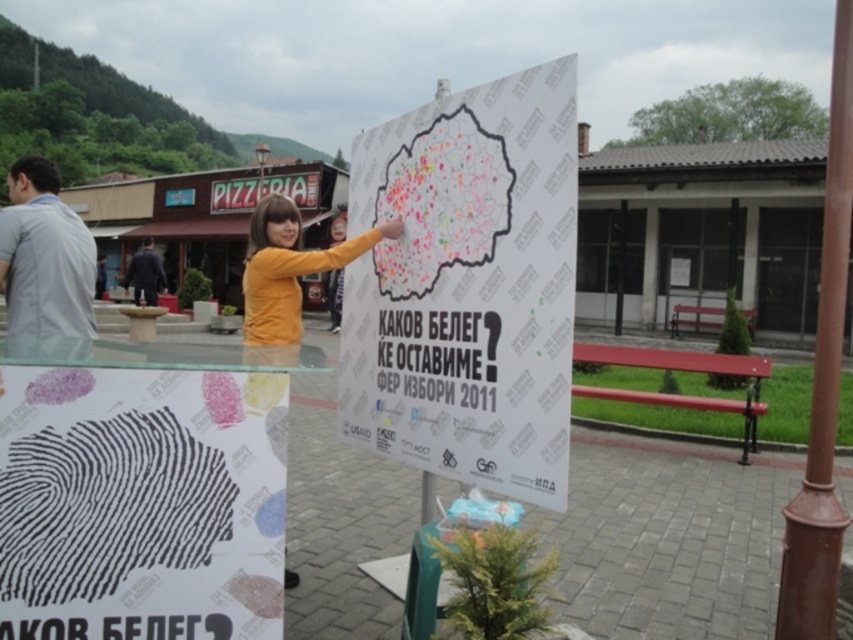
Question: Which point is farther to the camera?

Choices:
 (A) white paper poster at center
 (B) dark blue coat at left
 (C) brown polished metal pole at center right
 (D) yellow matte shirt at center

Answer: (B)

Question: Among these points, which one is nearest to the camera?

Choices:
 (A) (48, 288)
 (B) (277, 540)
 (C) (521, 100)

Answer: (B)

Question: Is white paper poster at center thinner than dark blue coat at left?

Choices:
 (A) yes
 (B) no

Answer: (A)

Question: Can you confirm if colored paper map at center is positioned to the right of dark blue coat at left?

Choices:
 (A) no
 (B) yes

Answer: (B)

Question: Which point appears closest to the camera in this image?

Choices:
 (A) (148, 298)
 (B) (403, 248)
 (C) (230, 620)
 (D) (808, 616)

Answer: (C)

Question: Can you confirm if brown polished metal pole at center right is positioned above gray fabric shirt at left?

Choices:
 (A) yes
 (B) no

Answer: (A)